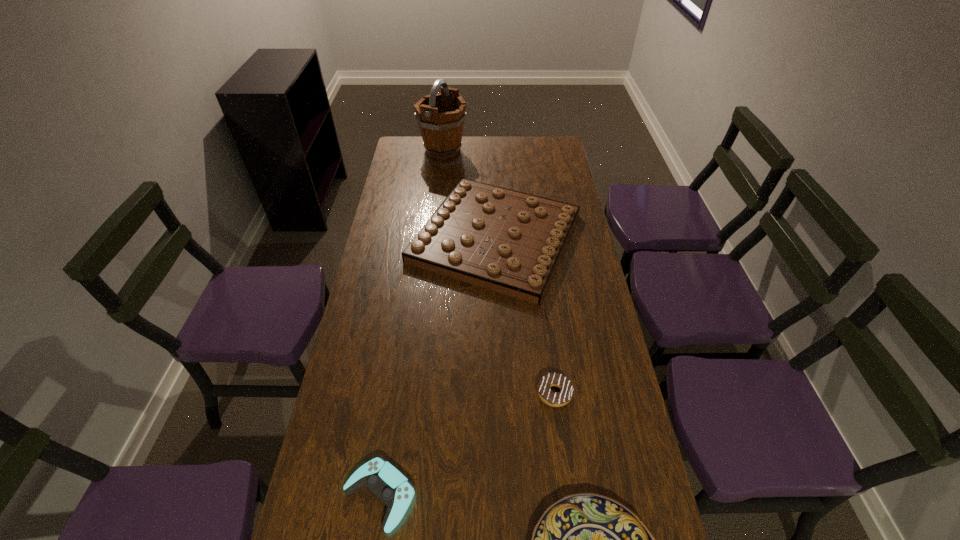
You are a GUI agent. You are given a task and a screenshot of the screen. Output one action in this format:
    pyautogui.click(x=<x>, y=<y>)
    Task: Click on the vacant space at the right edge
    
    Given the screenshot: What is the action you would take?
    pyautogui.click(x=575, y=273)

Identify the location of vacant point at the far right corner. (543, 153).

The height and width of the screenshot is (540, 960). Identify the location of empty location between the second farthest object and the second shortest object. (525, 315).

Where is `free space between the control and the second farthest object`? free space between the control and the second farthest object is located at coordinates (438, 367).

This screenshot has width=960, height=540. Identify the location of free area in between the second farthest object and the third nearest object. (525, 315).

Locate which object ranks third in proximity to the third nearest object. Please provide its 2D coordinates. Your answer should be formatted as a tuple, i.e. [(x, y)], where the tuple contains the x and y coordinates of a point satisfying the conditions above.

[(390, 486)]

At what (x,y) coordinates should I click in order to perform the action: click on the third closest object to the shortest object. Please return your answer as a coordinate pair (x, y). The height and width of the screenshot is (540, 960). Looking at the image, I should click on (510, 242).